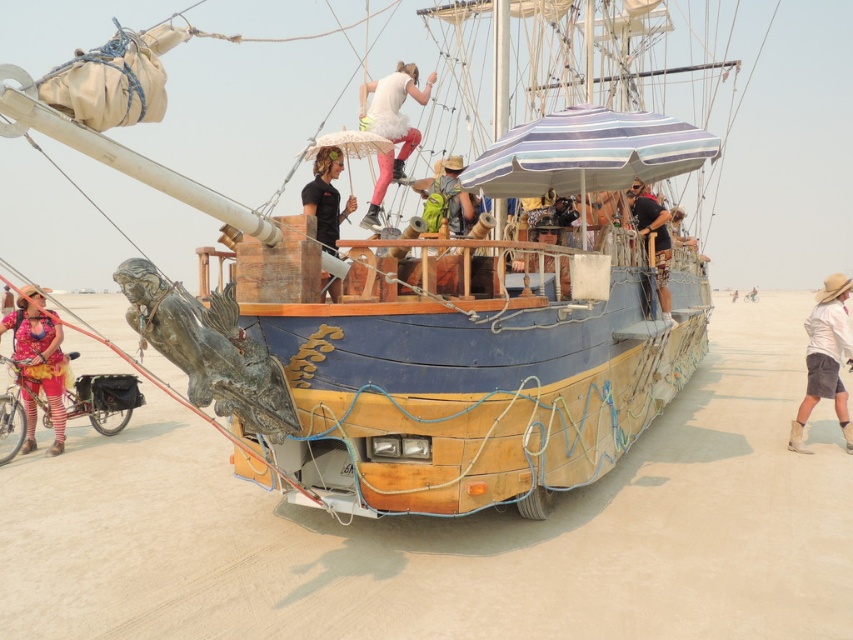
You are standing in front of the wooden boat at center. If you want to take a photo of it from a distance where it appears smaller, should you move closer or farther away?

To make the wooden boat at center appear smaller in the photo, you should move farther away from it since it is currently 5.69 meters away from the camera.

You are a photographer planning to take a portrait of two people wearing a floral fabric dress at lower left and a matte black shirt at upper center. You want to ensure their positions reflect their actual arrangement in the image. Where should you place the person in the floral fabric dress relative to the person in the matte black shirt?

The floral fabric dress at lower left should be positioned to the left of the matte black shirt at upper center to match their arrangement in the image.